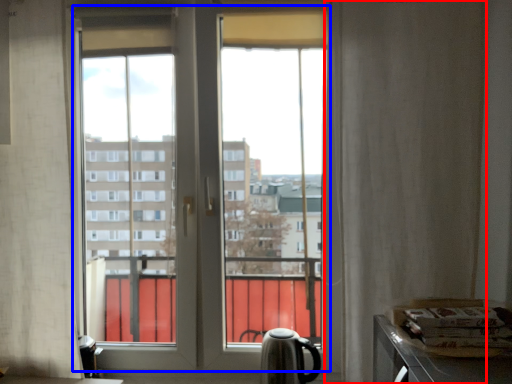
Question: Which object is closer to the camera taking this photo, curtain (highlighted by a red box) or bay window (highlighted by a blue box)?

Choices:
 (A) curtain
 (B) bay window

Answer: (A)